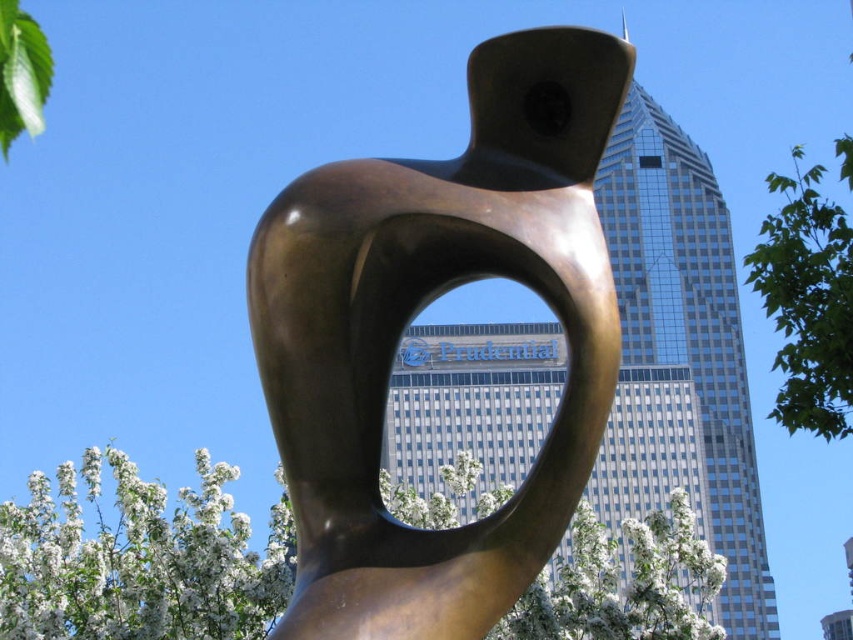
You are an art student standing in front of the bronze sculpture at center and the green leafy tree at right. You need to sketch both objects. Which one should you choose if you want to capture an object with a narrower width?

The bronze sculpture at center has a lesser width compared to the green leafy tree at right, so you should choose the bronze sculpture at center to capture an object with a narrower width.

You are standing in front of the bronze sculpture at center. If you were to draw a dot exactly where the center of the sculpture is located on a grid, what coordinates would you mark?

The center of the bronze sculpture at center is located at coordinates approximately 0.491 in the x direction and 0.489 in the y direction.

Looking at this image, you are standing at the camera position and want to take a photo of the bronze sculpture at center. If your camera has a maximum focus range of 25 meters, will it be able to capture the sculpture clearly?

The bronze sculpture at center and camera are 24.45 meters apart, so yes, the camera can capture the sculpture clearly since the distance is within the maximum focus range of 25 meters.